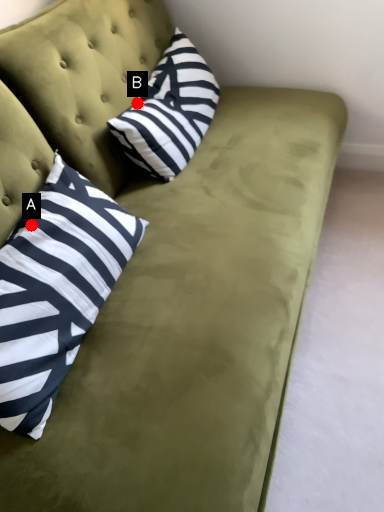
Question: Two points are circled on the image, labeled by A and B beside each circle. Which point is closer to the camera taking this photo?

Choices:
 (A) A is closer
 (B) B is closer

Answer: (A)